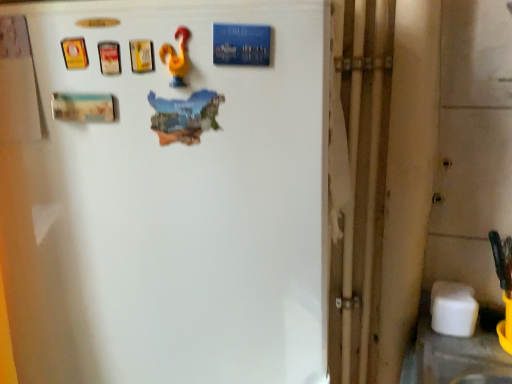
Question: Is white glossy refrigerator at upper center a part of yellow rubber rooster at upper center?

Choices:
 (A) no
 (B) yes

Answer: (A)

Question: Can you confirm if yellow rubber rooster at upper center is smaller than white glossy refrigerator at upper center?

Choices:
 (A) yes
 (B) no

Answer: (A)

Question: From the image's perspective, is yellow rubber rooster at upper center below white glossy refrigerator at upper center?

Choices:
 (A) no
 (B) yes

Answer: (A)

Question: From a real-world perspective, is yellow rubber rooster at upper center on white glossy refrigerator at upper center?

Choices:
 (A) yes
 (B) no

Answer: (A)

Question: Can you confirm if yellow rubber rooster at upper center is wider than white glossy refrigerator at upper center?

Choices:
 (A) yes
 (B) no

Answer: (B)

Question: Is yellow rubber rooster at upper center closer to camera compared to white glossy refrigerator at upper center?

Choices:
 (A) yes
 (B) no

Answer: (B)

Question: Does white glossy refrigerator at upper center have a smaller size compared to yellow rubber rooster at upper center?

Choices:
 (A) no
 (B) yes

Answer: (A)

Question: Is white glossy refrigerator at upper center facing away from yellow rubber rooster at upper center?

Choices:
 (A) no
 (B) yes

Answer: (A)

Question: From a real-world perspective, does white glossy refrigerator at upper center sit lower than yellow rubber rooster at upper center?

Choices:
 (A) no
 (B) yes

Answer: (B)

Question: Does white glossy refrigerator at upper center have a greater width compared to yellow rubber rooster at upper center?

Choices:
 (A) yes
 (B) no

Answer: (A)

Question: From the image's perspective, is white glossy refrigerator at upper center beneath yellow rubber rooster at upper center?

Choices:
 (A) no
 (B) yes

Answer: (B)

Question: Does white glossy refrigerator at upper center have a larger size compared to yellow rubber rooster at upper center?

Choices:
 (A) no
 (B) yes

Answer: (B)

Question: Visually, is yellow rubber rooster at upper center positioned to the left or to the right of white glossy refrigerator at upper center?

Choices:
 (A) left
 (B) right

Answer: (B)